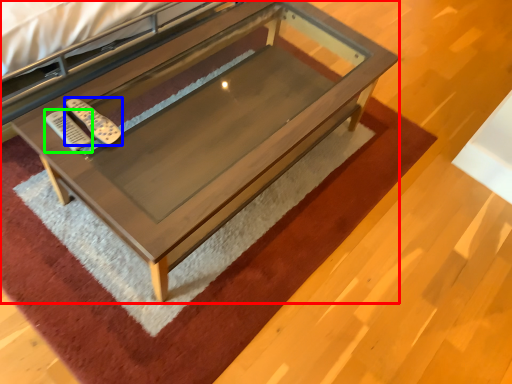
Question: Considering the real-world distances, which object is farthest from table (highlighted by a red box)? remote (highlighted by a blue box) or remote (highlighted by a green box)?

Choices:
 (A) remote
 (B) remote

Answer: (B)